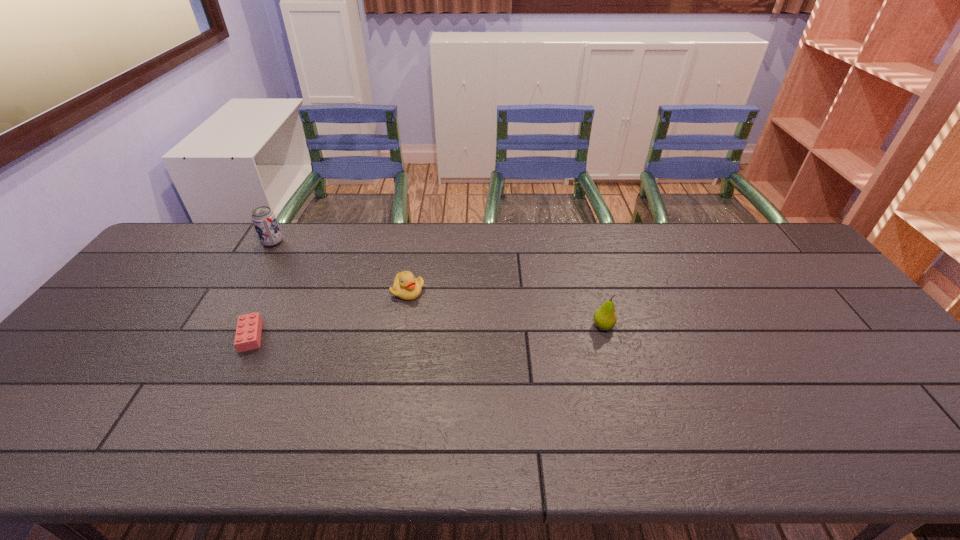
Identify the location of the leftmost object. (263, 218).

Identify the location of beer can. (263, 218).

Image resolution: width=960 pixels, height=540 pixels. Identify the location of pear. (605, 318).

You are a GUI agent. You are given a task and a screenshot of the screen. Output one action in this format:
    pyautogui.click(x=<x>, y=<y>)
    Task: Click on the third object from left to right
    The width and height of the screenshot is (960, 540).
    Given the screenshot: What is the action you would take?
    pos(406,286)

Where is `the third tallest object`? This screenshot has width=960, height=540. the third tallest object is located at coordinates [406, 286].

At what (x,y) coordinates should I click in order to perform the action: click on the second object from left to right. Please return your answer as a coordinate pair (x, y). The width and height of the screenshot is (960, 540). Looking at the image, I should click on (248, 332).

At what (x,y) coordinates should I click in order to perform the action: click on Lego. Please return your answer as a coordinate pair (x, y). The width and height of the screenshot is (960, 540). Looking at the image, I should click on (248, 332).

Identify the location of free space located 0.400m on the front of the farthest object. The image size is (960, 540). (214, 341).

Locate an element on the screen. Image resolution: width=960 pixels, height=540 pixels. vacant region located 0.120m on the left of the pear is located at coordinates (548, 326).

Identify the location of vacant space situated 0.120m on the front-facing side of the third tallest object. This screenshot has width=960, height=540. (400, 334).